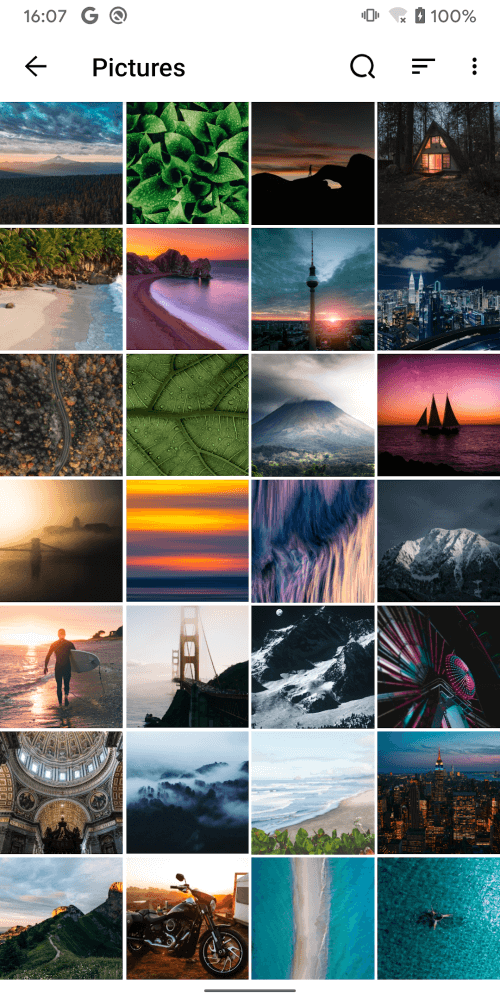
Where is `bike picture`? This screenshot has width=500, height=1000. bike picture is located at coordinates (212, 927).